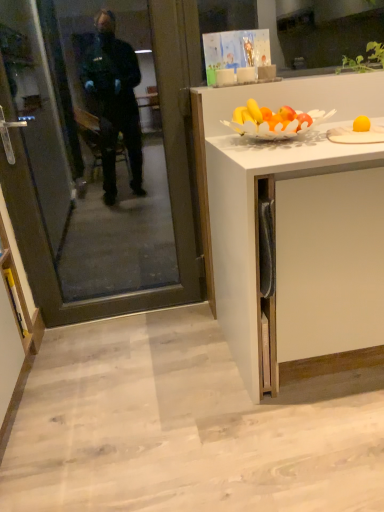
Question: Is white matte cabinet at right, acting as the 2th cabinetry starting from the left, positioned with its back to yellow marker at lower left, placed as the first cabinetry when sorted from left to right?

Choices:
 (A) yes
 (B) no

Answer: (B)

Question: Is yellow marker at lower left, the second cabinetry when ordered from right to left, inside white matte cabinet at right, acting as the 2th cabinetry starting from the left?

Choices:
 (A) no
 (B) yes

Answer: (A)

Question: Is white matte cabinet at right, arranged as the first cabinetry when viewed from the right, smaller than yellow marker at lower left, the second cabinetry when ordered from right to left?

Choices:
 (A) yes
 (B) no

Answer: (B)

Question: Can you confirm if white matte cabinet at right, acting as the 2th cabinetry starting from the left, is thinner than yellow marker at lower left, placed as the first cabinetry when sorted from left to right?

Choices:
 (A) yes
 (B) no

Answer: (B)

Question: Does white matte cabinet at right, arranged as the first cabinetry when viewed from the right, come behind yellow marker at lower left, placed as the first cabinetry when sorted from left to right?

Choices:
 (A) no
 (B) yes

Answer: (A)

Question: In terms of width, does white matte cabinet at right, acting as the 2th cabinetry starting from the left, look wider or thinner when compared to yellow matte plate at upper right?

Choices:
 (A) thin
 (B) wide

Answer: (B)

Question: Is white matte cabinet at right, acting as the 2th cabinetry starting from the left, to the left or to the right of yellow matte plate at upper right in the image?

Choices:
 (A) right
 (B) left

Answer: (B)

Question: Looking at the image, does white matte cabinet at right, acting as the 2th cabinetry starting from the left, seem bigger or smaller compared to yellow matte plate at upper right?

Choices:
 (A) big
 (B) small

Answer: (A)

Question: Is white matte cabinet at right, arranged as the first cabinetry when viewed from the right, inside the boundaries of yellow matte plate at upper right, or outside?

Choices:
 (A) outside
 (B) inside

Answer: (A)

Question: Relative to yellow marker at lower left, the second cabinetry when ordered from right to left, is transparent glass door at left in front or behind?

Choices:
 (A) front
 (B) behind

Answer: (A)

Question: Is transparent glass door at left taller or shorter than yellow marker at lower left, the second cabinetry when ordered from right to left?

Choices:
 (A) tall
 (B) short

Answer: (A)

Question: In terms of width, does transparent glass door at left look wider or thinner when compared to yellow marker at lower left, placed as the first cabinetry when sorted from left to right?

Choices:
 (A) thin
 (B) wide

Answer: (A)

Question: In terms of size, does transparent glass door at left appear bigger or smaller than yellow marker at lower left, the second cabinetry when ordered from right to left?

Choices:
 (A) small
 (B) big

Answer: (B)

Question: From the image's perspective, relative to yellow marker at lower left, placed as the first cabinetry when sorted from left to right, is white matte cabinet at right, acting as the 2th cabinetry starting from the left, above or below?

Choices:
 (A) above
 (B) below

Answer: (A)

Question: Is white matte cabinet at right, arranged as the first cabinetry when viewed from the right, wider or thinner than yellow marker at lower left, the second cabinetry when ordered from right to left?

Choices:
 (A) thin
 (B) wide

Answer: (B)